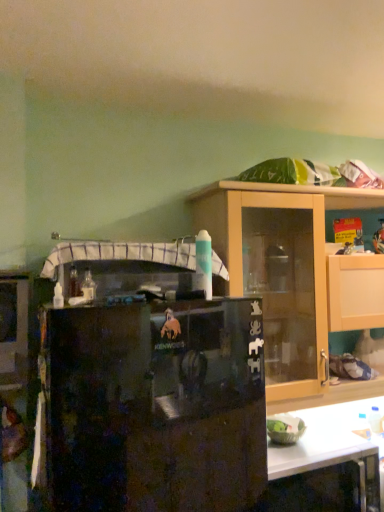
I want to click on black matte refrigerator at center, so click(154, 406).

The width and height of the screenshot is (384, 512). What do you see at coordinates (154, 406) in the screenshot?
I see `black matte refrigerator at center` at bounding box center [154, 406].

Where is `wooden cabinet at upper right`? The height and width of the screenshot is (512, 384). wooden cabinet at upper right is located at coordinates (282, 277).

In order to face wooden cabinet at upper right, should I rotate leftwards or rightwards?

Rotate right and turn 16.977 degrees.

What is the approximate height of wooden cabinet at upper right?

32.72 inches.

This screenshot has width=384, height=512. What do you see at coordinates (282, 277) in the screenshot?
I see `wooden cabinet at upper right` at bounding box center [282, 277].

You are a GUI agent. You are given a task and a screenshot of the screen. Output one action in this format:
    pyautogui.click(x=<x>, y=<y>)
    Task: Click on the black matte refrigerator at center
    
    Given the screenshot: What is the action you would take?
    pyautogui.click(x=154, y=406)

Between wooden cabinet at upper right and black matte refrigerator at center, which one appears on the left side from the viewer's perspective?

From the viewer's perspective, black matte refrigerator at center appears more on the left side.

Considering the relative positions of wooden cabinet at upper right and black matte refrigerator at center in the image provided, is wooden cabinet at upper right behind black matte refrigerator at center?

Yes, wooden cabinet at upper right is behind black matte refrigerator at center.

Which is behind, point (314, 233) or point (112, 474)?

The point (314, 233) is farther.

From the image's perspective, between wooden cabinet at upper right and black matte refrigerator at center, which one is located above?

wooden cabinet at upper right, from the image's perspective.

From a real-world perspective, is wooden cabinet at upper right positioned under black matte refrigerator at center based on gravity?

No.

Can you confirm if wooden cabinet at upper right is thinner than black matte refrigerator at center?

Yes.

Considering the sizes of objects wooden cabinet at upper right and black matte refrigerator at center in the image provided, who is shorter, wooden cabinet at upper right or black matte refrigerator at center?

wooden cabinet at upper right.

Which of these two, wooden cabinet at upper right or black matte refrigerator at center, is bigger?

black matte refrigerator at center.

Is wooden cabinet at upper right located outside black matte refrigerator at center?

Yes, wooden cabinet at upper right is not within black matte refrigerator at center.

Is wooden cabinet at upper right placed right next to black matte refrigerator at center?

No, wooden cabinet at upper right is not touching black matte refrigerator at center.

Could you tell me if wooden cabinet at upper right is facing black matte refrigerator at center?

No, wooden cabinet at upper right does not turn towards black matte refrigerator at center.

You are a GUI agent. You are given a task and a screenshot of the screen. Output one action in this format:
    pyautogui.click(x=<x>, y=<y>)
    Task: Click on the refrigerator in front of the wooden cabinet at upper right
    Image resolution: width=384 pixels, height=512 pixels.
    Given the screenshot: What is the action you would take?
    (x=154, y=406)

Is black matte refrigerator at center to the left or to the right of wooden cabinet at upper right in the image?

In the image, black matte refrigerator at center appears on the left side of wooden cabinet at upper right.

Which is in front, black matte refrigerator at center or wooden cabinet at upper right?

black matte refrigerator at center.

Is point (62, 421) closer or farther from the camera than point (253, 213)?

Clearly, point (62, 421) is closer to the camera than point (253, 213).

From the image's perspective, who appears lower, black matte refrigerator at center or wooden cabinet at upper right?

black matte refrigerator at center.

From a real-world perspective, does black matte refrigerator at center stand above wooden cabinet at upper right?

No, from a real-world perspective, black matte refrigerator at center is not above wooden cabinet at upper right.

In terms of width, does black matte refrigerator at center look wider or thinner when compared to wooden cabinet at upper right?

Result: In the image, black matte refrigerator at center appears to be wider than wooden cabinet at upper right.

Considering the sizes of objects black matte refrigerator at center and wooden cabinet at upper right in the image provided, who is taller, black matte refrigerator at center or wooden cabinet at upper right?

black matte refrigerator at center is taller.

Between black matte refrigerator at center and wooden cabinet at upper right, which one has larger size?

black matte refrigerator at center is bigger.

From the picture: Which is correct: black matte refrigerator at center is inside wooden cabinet at upper right, or outside of it?

black matte refrigerator at center is not inside wooden cabinet at upper right, it's outside.

Consider the image. Is black matte refrigerator at center next to wooden cabinet at upper right and touching it?

black matte refrigerator at center and wooden cabinet at upper right are clearly separated.

Is black matte refrigerator at center facing away from wooden cabinet at upper right?

black matte refrigerator at center is not turned away from wooden cabinet at upper right.

What's the angular difference between black matte refrigerator at center and wooden cabinet at upper right's facing directions?

1.24e-05 degrees.

You are a GUI agent. You are given a task and a screenshot of the screen. Output one action in this format:
    pyautogui.click(x=<x>, y=<y>)
    Task: Click on the refrigerator below the wooden cabinet at upper right (from a real-world perspective)
    This screenshot has height=512, width=384.
    Given the screenshot: What is the action you would take?
    pyautogui.click(x=154, y=406)

Identify the location of cabinetry that is behind the black matte refrigerator at center. The width and height of the screenshot is (384, 512). click(282, 277).

At what (x,y) coordinates should I click in order to perform the action: click on cabinetry on the right of the black matte refrigerator at center. Please return your answer as a coordinate pair (x, y). Looking at the image, I should click on (282, 277).